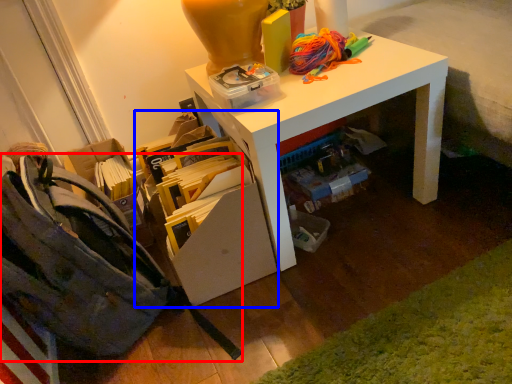
Question: Among these objects, which one is nearest to the camera, shoulder bag (highlighted by a red box) or shelf (highlighted by a blue box)?

Choices:
 (A) shoulder bag
 (B) shelf

Answer: (A)